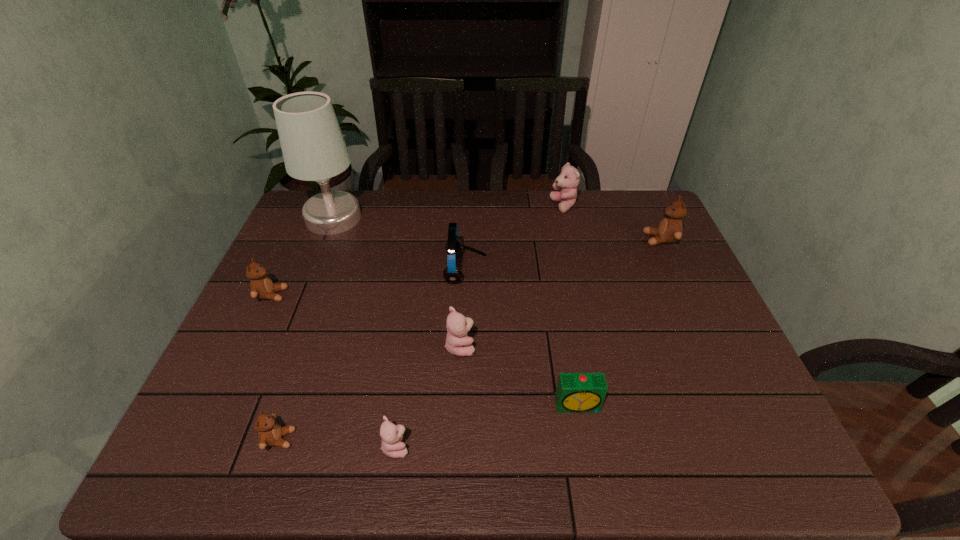
At what (x,y) coordinates should I click in order to perform the action: click on lampshade at the far edge. Please return your answer as a coordinate pair (x, y). This screenshot has height=540, width=960. Looking at the image, I should click on click(313, 147).

Locate an element on the screen. lampshade present at the left edge is located at coordinates (313, 147).

Identify the location of teddy bear positioned at the left edge. The height and width of the screenshot is (540, 960). (261, 286).

This screenshot has width=960, height=540. Identify the location of object that is at the right edge. (670, 229).

What are the coordinates of `object at the far left corner` in the screenshot? It's located at (313, 147).

You are a GUI agent. You are given a task and a screenshot of the screen. Output one action in this format:
    pyautogui.click(x=<x>, y=<y>)
    Task: Click on the object that is positioned at the far right corner
    
    Given the screenshot: What is the action you would take?
    pyautogui.click(x=670, y=229)

In the image, there is a desktop. Where is `vacant space at the far edge`? This screenshot has width=960, height=540. vacant space at the far edge is located at coordinates (536, 232).

Where is `vacant region at the near edge of the desktop`? vacant region at the near edge of the desktop is located at coordinates (648, 456).

Image resolution: width=960 pixels, height=540 pixels. Find the location of `vacant space at the left edge of the desktop`. vacant space at the left edge of the desktop is located at coordinates point(244,339).

This screenshot has width=960, height=540. Find the location of `free region at the right edge of the desktop`. free region at the right edge of the desktop is located at coordinates (711, 328).